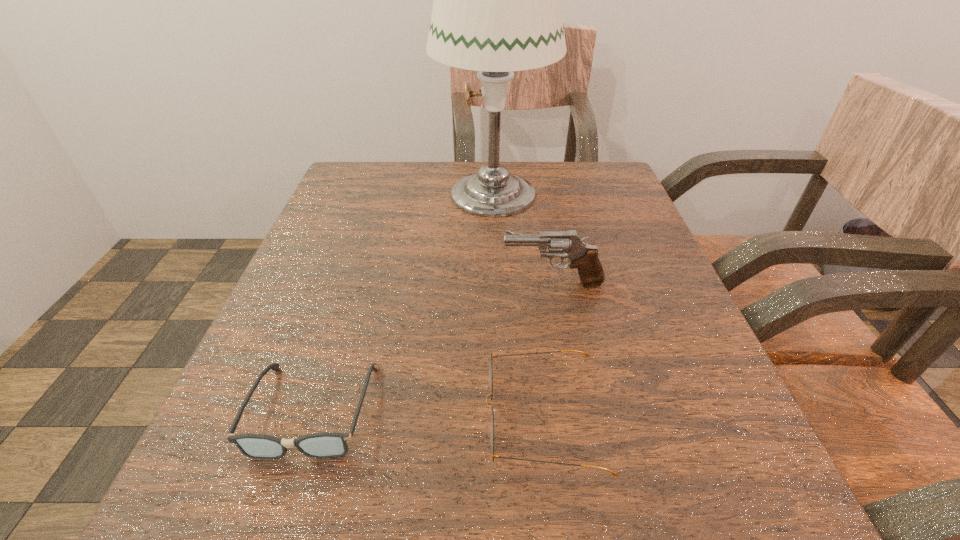
The width and height of the screenshot is (960, 540). Find the location of `the tallest object`. the tallest object is located at coordinates (497, 9).

At what (x,y) coordinates should I click in order to perform the action: click on lampshade. Please return your answer as a coordinate pair (x, y). Image resolution: width=960 pixels, height=540 pixels. Looking at the image, I should click on (497, 9).

Locate an element on the screen. The width and height of the screenshot is (960, 540). pistol is located at coordinates (565, 244).

The image size is (960, 540). Find the location of `the third shortest object`. the third shortest object is located at coordinates (565, 244).

The height and width of the screenshot is (540, 960). Find the location of `the third tallest object`. the third tallest object is located at coordinates (490, 373).

Where is `the taller spectacles`? the taller spectacles is located at coordinates (490, 373).

You are a GUI agent. You are given a task and a screenshot of the screen. Output one action in this format:
    pyautogui.click(x=<x>, y=<y>)
    Task: Click on the shortest object
    This screenshot has width=960, height=540.
    Given the screenshot: What is the action you would take?
    tap(321, 445)

Locate an element on the screen. the shorter spectacles is located at coordinates (321, 445).

The width and height of the screenshot is (960, 540). What are the coordinates of `vacant space located on the lampshade of the lampshade` in the screenshot? It's located at [x=351, y=193].

At what (x,y) coordinates should I click in order to perform the action: click on vacant point located on the lampshade of the lampshade. Please return your answer as a coordinate pair (x, y). Image resolution: width=960 pixels, height=540 pixels. Looking at the image, I should click on (387, 193).